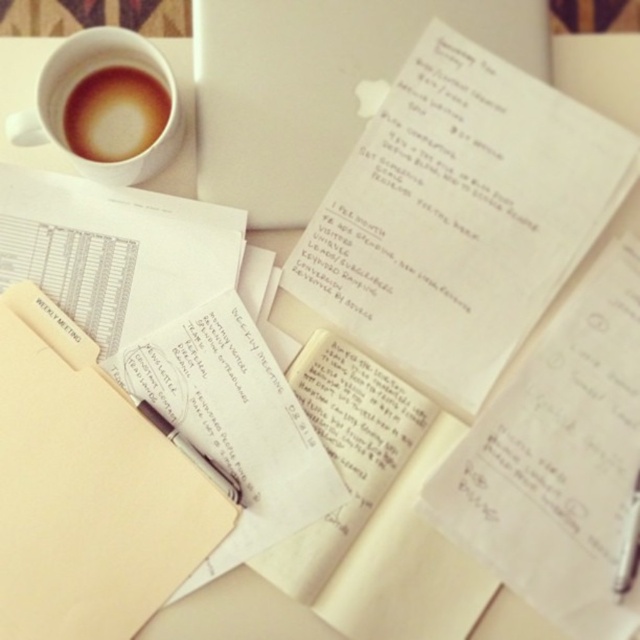
What is the color of the object located at point (458,218)?

The object at point (458,218) is white paper at center.

You are organizing the items on your desk and notice the white matte cup at upper left and the brown frothy coffee at upper left. Which item is placed above the other?

The white matte cup at upper left is positioned over brown frothy coffee at upper left, so the white matte cup at upper left is above the brown frothy coffee at upper left.

You are a barista who needs to deliver the brown frothy coffee at upper left to a customer standing 24 inches away from you. Can you hand it over without moving your position?

The brown frothy coffee at upper left is 20.16 inches away from you, so yes, you can hand it over without moving since the customer is within reach.